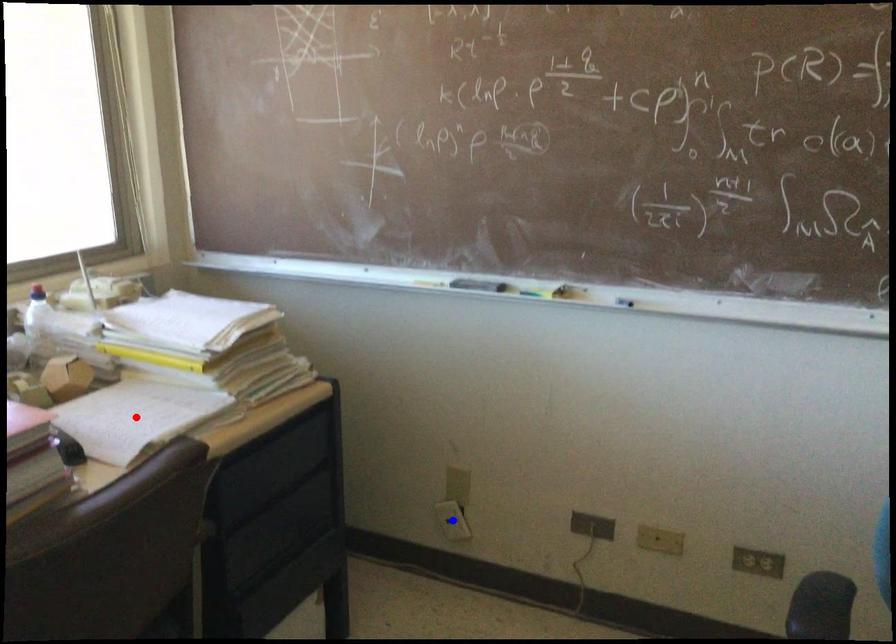
Question: Which of the two points in the image is closer to the camera?

Choices:
 (A) Blue point is closer.
 (B) Red point is closer.

Answer: (B)